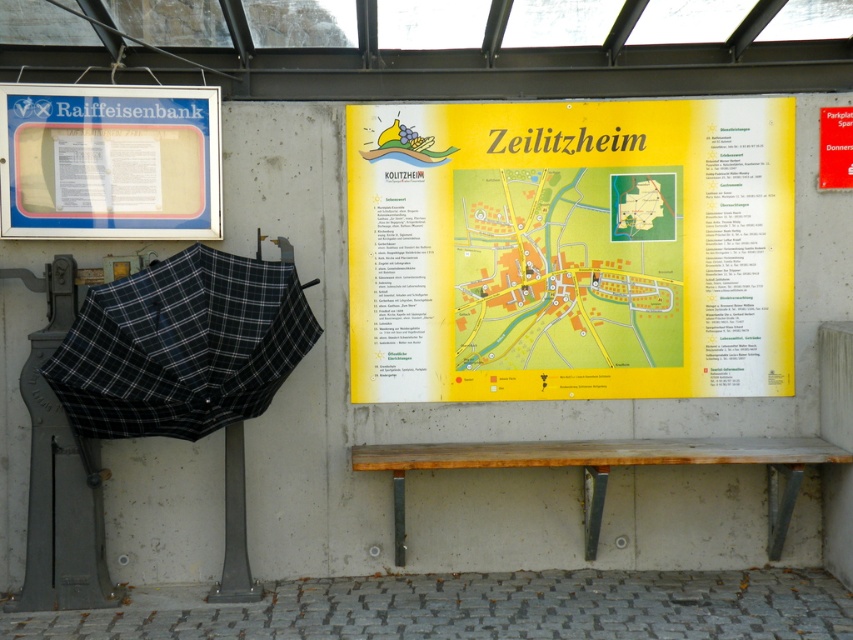
Question: Does yellow paper map at center have a lesser width compared to black checkered umbrella at left?

Choices:
 (A) no
 (B) yes

Answer: (B)

Question: Estimate the real-world distances between objects in this image. Which object is farther from the black checkered umbrella at left?

Choices:
 (A) matte plastic sign at upper left
 (B) wooden bench at lower center
 (C) yellow paper map at upper center

Answer: (B)

Question: Is yellow paper map at center above wooden bench at lower center?

Choices:
 (A) no
 (B) yes

Answer: (B)

Question: Which object appears closest to the camera in this image?

Choices:
 (A) yellow paper map at center
 (B) yellow paper map at upper center
 (C) black checkered umbrella at left

Answer: (C)

Question: Where is yellow paper map at upper center located in relation to black checkered umbrella at left in the image?

Choices:
 (A) below
 (B) above

Answer: (B)

Question: Which is farther from the wooden bench at lower center?

Choices:
 (A) black checkered umbrella at left
 (B) matte plastic sign at upper left

Answer: (B)